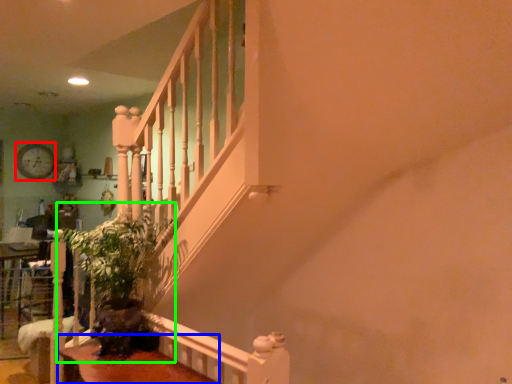
Question: Based on their relative distances, which object is nearer to clock (highlighted by a red box)? Choose from table (highlighted by a blue box) and plant (highlighted by a green box).

Choices:
 (A) table
 (B) plant

Answer: (B)